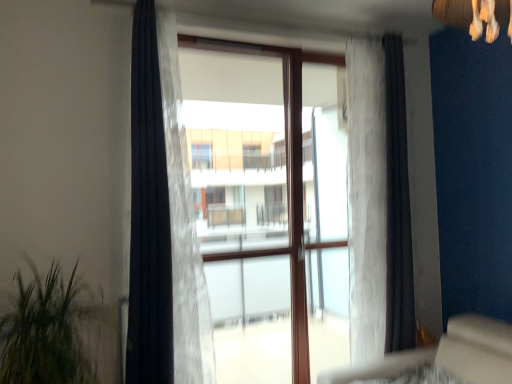
What do you see at coordinates (183, 225) in the screenshot? I see `translucent fabric curtain at center, the second curtain when ordered from left to right` at bounding box center [183, 225].

Describe the element at coordinates (268, 207) in the screenshot. The height and width of the screenshot is (384, 512). I see `transparent glass door at center` at that location.

In order to face black sheer curtain at left, which is the fourth curtain in right-to-left order, should I rotate leftwards or rightwards?

To align with it, rotate left about 15.462°.

Measure the distance between point (390, 92) and camera.

Point (390, 92) and camera are 8.76 feet apart.

Find the location of a particular element. black fabric curtain at right, the fourth curtain viewed from the left is located at coordinates coord(397,206).

You are a GUI agent. You are given a task and a screenshot of the screen. Output one action in this format:
    pyautogui.click(x=<x>, y=<y>)
    Task: Click on the white sheer curtain at center, the third curtain positioned from the left
    
    Given the screenshot: What is the action you would take?
    pyautogui.click(x=366, y=198)

You are a GUI agent. You are given a task and a screenshot of the screen. Output one action in this format:
    pyautogui.click(x=<x>, y=<y>)
    Task: Click on the translucent fabric curtain at center, marked as the 3th curtain in a right-to-left arrangement
    Image resolution: width=512 pixels, height=384 pixels.
    Given the screenshot: What is the action you would take?
    pyautogui.click(x=183, y=225)

Looking at their sizes, would you say white sheer curtain at center, the third curtain positioned from the left, is wider or thinner than black fabric curtain at right, which appears as the 1th curtain when viewed from the right?

Clearly, white sheer curtain at center, the third curtain positioned from the left, has more width compared to black fabric curtain at right, which appears as the 1th curtain when viewed from the right.

Considering the positions of objects white sheer curtain at center, the third curtain positioned from the left, and black fabric curtain at right, which appears as the 1th curtain when viewed from the right, in the image provided, who is in front, white sheer curtain at center, the third curtain positioned from the left, or black fabric curtain at right, which appears as the 1th curtain when viewed from the right,?

white sheer curtain at center, the third curtain positioned from the left, is in front.

Considering the sizes of objects white sheer curtain at center, the third curtain positioned from the left, and black fabric curtain at right, which appears as the 1th curtain when viewed from the right, in the image provided, who is smaller, white sheer curtain at center, the third curtain positioned from the left, or black fabric curtain at right, which appears as the 1th curtain when viewed from the right,?

black fabric curtain at right, which appears as the 1th curtain when viewed from the right.

Based on the photo, from the image's perspective, is green leafy plant at left located above transparent glass door at center?

No, from the image's perspective, green leafy plant at left is not over transparent glass door at center.

Is transparent glass door at center completely or partially inside green leafy plant at left?

No, transparent glass door at center is not a part of green leafy plant at left.

How many degrees apart are the facing directions of green leafy plant at left and transparent glass door at center?

The angle between the facing direction of green leafy plant at left and the facing direction of transparent glass door at center is 91.3 degrees.

This screenshot has width=512, height=384. Identify the location of bay window below the white sheer curtain at center, the third curtain positioned from the left (from a real-world perspective). (268, 207).

How much distance is there between transparent glass door at center and white sheer curtain at center, the third curtain positioned from the left?

They are 17.90 inches apart.

Does point (263, 119) lie in front of point (358, 78)?

No, it is behind (358, 78).

Is transparent glass door at center not within white sheer curtain at center, the second curtain in the right-to-left sequence?

Indeed, transparent glass door at center is completely outside white sheer curtain at center, the second curtain in the right-to-left sequence.

Is transparent glass door at center directly adjacent to black fabric curtain at right, the fourth curtain viewed from the left?

No, transparent glass door at center is not in contact with black fabric curtain at right, the fourth curtain viewed from the left.

Is transparent glass door at center oriented away from black fabric curtain at right, which appears as the 1th curtain when viewed from the right?

No, black fabric curtain at right, which appears as the 1th curtain when viewed from the right, is not at the back of transparent glass door at center.

Consider the image. From a real-world perspective, which is physically above, transparent glass door at center or black fabric curtain at right, the fourth curtain viewed from the left?

black fabric curtain at right, the fourth curtain viewed from the left, from a real-world perspective.

From the picture: From the image's perspective, is black sheer curtain at left, positioned as the 1th curtain in left-to-right order, beneath translucent fabric curtain at center, the second curtain when ordered from left to right?

No, from the image's perspective, black sheer curtain at left, positioned as the 1th curtain in left-to-right order, is not beneath translucent fabric curtain at center, the second curtain when ordered from left to right.

Which of these two, black sheer curtain at left, which is the fourth curtain in right-to-left order, or translucent fabric curtain at center, marked as the 3th curtain in a right-to-left arrangement, is thinner?

black sheer curtain at left, which is the fourth curtain in right-to-left order, is thinner.

How many degrees apart are the facing directions of black sheer curtain at left, which is the fourth curtain in right-to-left order, and translucent fabric curtain at center, the second curtain when ordered from left to right?

The angle between the facing direction of black sheer curtain at left, which is the fourth curtain in right-to-left order, and the facing direction of translucent fabric curtain at center, the second curtain when ordered from left to right, is 0.00123 degrees.

Considering the relative sizes of black sheer curtain at left, positioned as the 1th curtain in left-to-right order, and transparent glass door at center in the image provided, is black sheer curtain at left, positioned as the 1th curtain in left-to-right order, shorter than transparent glass door at center?

Indeed, black sheer curtain at left, positioned as the 1th curtain in left-to-right order, has a lesser height compared to transparent glass door at center.

Which object is positioned more to the right, black sheer curtain at left, which is the fourth curtain in right-to-left order, or transparent glass door at center?

From the viewer's perspective, transparent glass door at center appears more on the right side.

Which of these two, black sheer curtain at left, which is the fourth curtain in right-to-left order, or transparent glass door at center, is smaller?

Smaller between the two is black sheer curtain at left, which is the fourth curtain in right-to-left order.

Between black sheer curtain at left, positioned as the 1th curtain in left-to-right order, and transparent glass door at center, which one has larger width?

black sheer curtain at left, positioned as the 1th curtain in left-to-right order.

Are black fabric curtain at right, the fourth curtain viewed from the left, and black sheer curtain at left, positioned as the 1th curtain in left-to-right order, far apart?

Yes, black fabric curtain at right, the fourth curtain viewed from the left, and black sheer curtain at left, positioned as the 1th curtain in left-to-right order, are located far from each other.

Can you confirm if black fabric curtain at right, which appears as the 1th curtain when viewed from the right, is positioned to the left of black sheer curtain at left, positioned as the 1th curtain in left-to-right order?

In fact, black fabric curtain at right, which appears as the 1th curtain when viewed from the right, is to the right of black sheer curtain at left, positioned as the 1th curtain in left-to-right order.

Is black fabric curtain at right, which appears as the 1th curtain when viewed from the right, bigger than black sheer curtain at left, positioned as the 1th curtain in left-to-right order?

Incorrect, black fabric curtain at right, which appears as the 1th curtain when viewed from the right, is not larger than black sheer curtain at left, positioned as the 1th curtain in left-to-right order.

Does point (394, 315) come farther from viewer compared to point (167, 352)?

Yes, point (394, 315) is farther from viewer.

This screenshot has height=384, width=512. I want to click on the 2nd curtain above when counting from the white sheer curtain at center, the third curtain positioned from the left (from the image's perspective), so pyautogui.click(x=397, y=206).

I want to click on bay window located on the right of green leafy plant at left, so click(x=268, y=207).

Looking at the image, which one is located further to translucent fabric curtain at center, the second curtain when ordered from left to right, transparent glass door at center or black sheer curtain at left, positioned as the 1th curtain in left-to-right order?

transparent glass door at center is positioned further to the anchor translucent fabric curtain at center, the second curtain when ordered from left to right.

Considering their positions, is transparent glass door at center positioned further to green leafy plant at left than black fabric curtain at right, which appears as the 1th curtain when viewed from the right?

black fabric curtain at right, which appears as the 1th curtain when viewed from the right, lies further to green leafy plant at left than the other object.

When comparing their distances from white sheer curtain at center, the third curtain positioned from the left, does black fabric curtain at right, which appears as the 1th curtain when viewed from the right, or black sheer curtain at left, positioned as the 1th curtain in left-to-right order, seem closer?

Among the two, black fabric curtain at right, which appears as the 1th curtain when viewed from the right, is located nearer to white sheer curtain at center, the third curtain positioned from the left.

Estimate the real-world distances between objects in this image. Which object is further from black sheer curtain at left, which is the fourth curtain in right-to-left order, black fabric curtain at right, the fourth curtain viewed from the left, or white sheer curtain at center, the third curtain positioned from the left?

black fabric curtain at right, the fourth curtain viewed from the left, lies further to black sheer curtain at left, which is the fourth curtain in right-to-left order, than the other object.

Looking at the image, which one is located closer to white sheer curtain at center, the second curtain in the right-to-left sequence, transparent glass door at center or green leafy plant at left?

transparent glass door at center is positioned closer to the anchor white sheer curtain at center, the second curtain in the right-to-left sequence.

Looking at the image, which one is located closer to black sheer curtain at left, which is the fourth curtain in right-to-left order, black fabric curtain at right, which appears as the 1th curtain when viewed from the right, or green leafy plant at left?

green leafy plant at left.

When comparing their distances from black sheer curtain at left, which is the fourth curtain in right-to-left order, does green leafy plant at left or white sheer curtain at center, the third curtain positioned from the left, seem further?

The object further to black sheer curtain at left, which is the fourth curtain in right-to-left order, is white sheer curtain at center, the third curtain positioned from the left.

When comparing their distances from translucent fabric curtain at center, the second curtain when ordered from left to right, does black fabric curtain at right, the fourth curtain viewed from the left, or white sheer curtain at center, the third curtain positioned from the left, seem closer?

white sheer curtain at center, the third curtain positioned from the left, is positioned closer to the anchor translucent fabric curtain at center, the second curtain when ordered from left to right.

In order to click on curtain situated between transparent glass door at center and black fabric curtain at right, which appears as the 1th curtain when viewed from the right, from left to right in this screenshot , I will do `click(366, 198)`.

Image resolution: width=512 pixels, height=384 pixels. Identify the location of bay window between translucent fabric curtain at center, the second curtain when ordered from left to right, and black fabric curtain at right, which appears as the 1th curtain when viewed from the right. (268, 207).

You are a GUI agent. You are given a task and a screenshot of the screen. Output one action in this format:
    pyautogui.click(x=<x>, y=<y>)
    Task: Click on the bay window situated between green leafy plant at left and black fabric curtain at right, which appears as the 1th curtain when viewed from the right, from left to right
    
    Given the screenshot: What is the action you would take?
    pyautogui.click(x=268, y=207)

You are a GUI agent. You are given a task and a screenshot of the screen. Output one action in this format:
    pyautogui.click(x=<x>, y=<y>)
    Task: Click on the curtain between green leafy plant at left and translucent fabric curtain at center, the second curtain when ordered from left to right, in the front-back direction
    This screenshot has height=384, width=512.
    Given the screenshot: What is the action you would take?
    pyautogui.click(x=149, y=215)